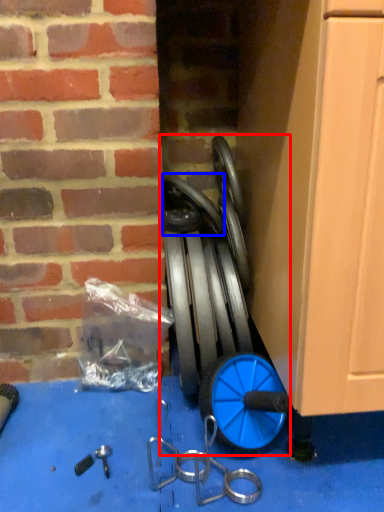
Question: Among these objects, which one is nearest to the camera, garden hose (highlighted by a red box) or wheel (highlighted by a blue box)?

Choices:
 (A) garden hose
 (B) wheel

Answer: (A)